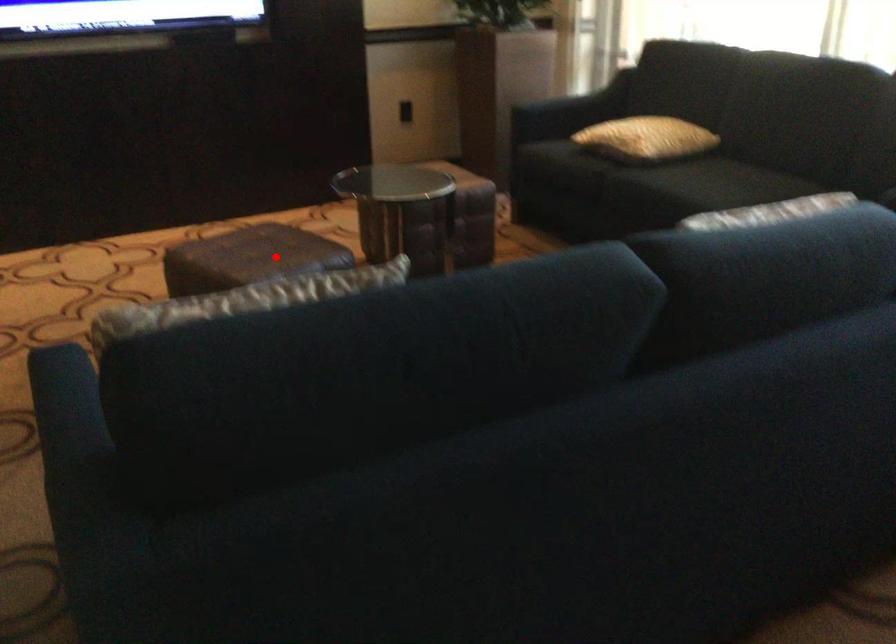
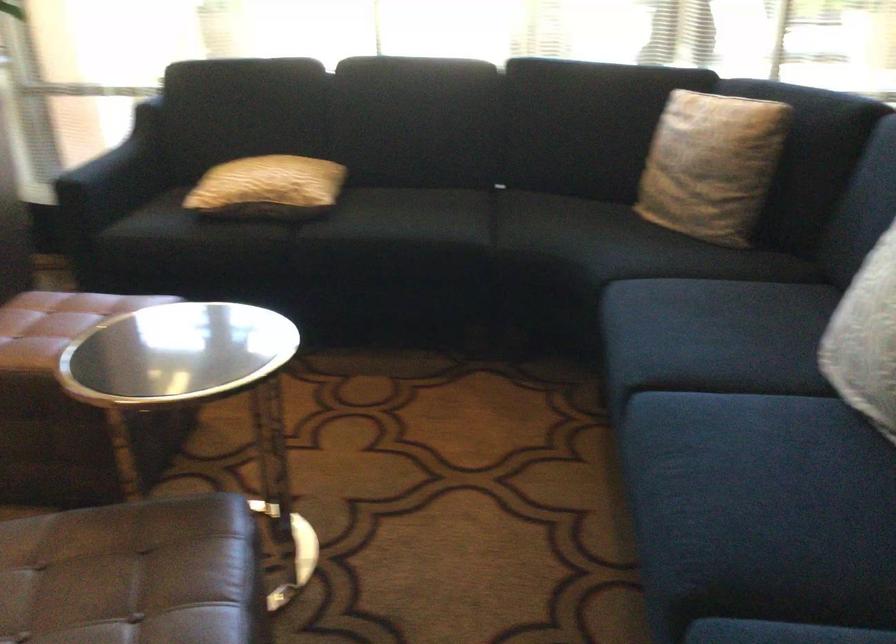
Question: I am providing you with two images of the same scene from different viewpoints. In image1, a red point is highlighted. Considering the same 3D point in image2, which of the following is correct?

Choices:
 (A) It is closer
 (B) It is farther

Answer: (A)